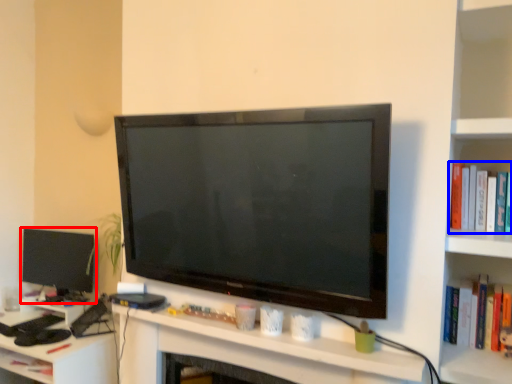
Question: Which point is closer to the camera, television (highlighted by a red box) or book (highlighted by a blue box)?

Choices:
 (A) television
 (B) book

Answer: (B)